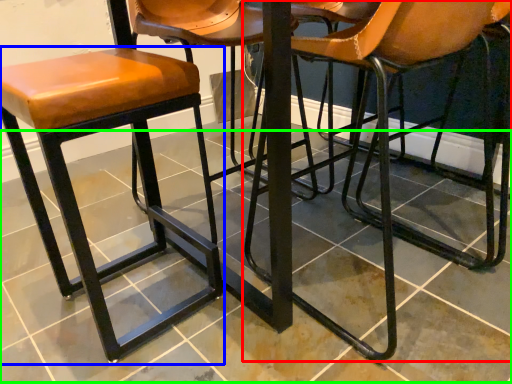
Question: Which object is positioned closest to chair (highlighted by a red box)? Select from stool (highlighted by a blue box) and tile (highlighted by a green box).

Choices:
 (A) stool
 (B) tile

Answer: (B)